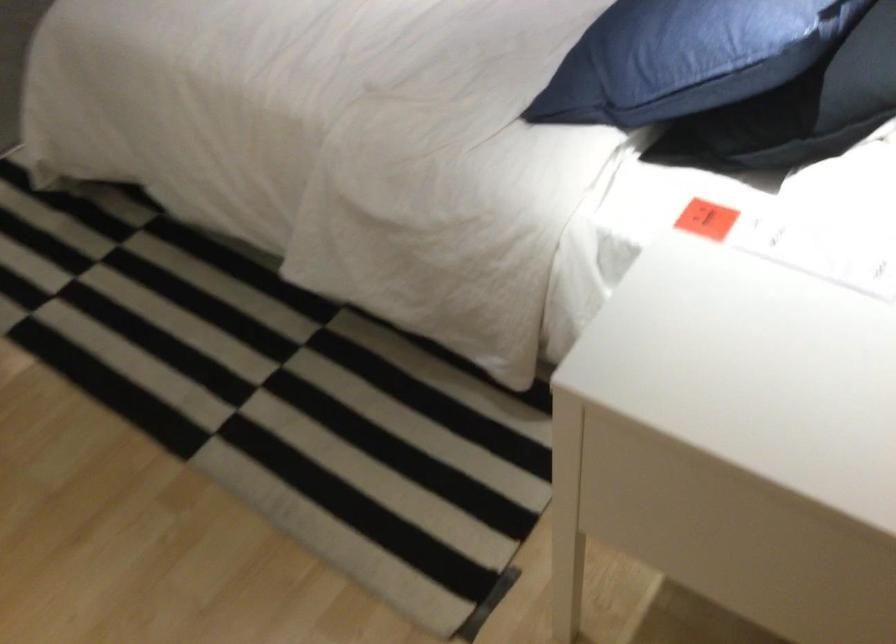
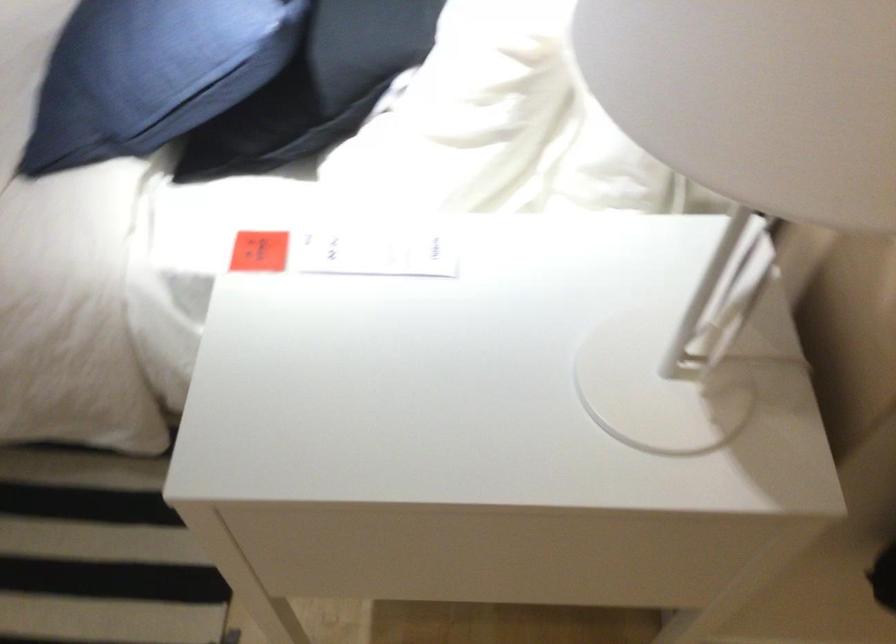
In the second image, find the point that corresponds to point (819, 254) in the first image.

(375, 252)